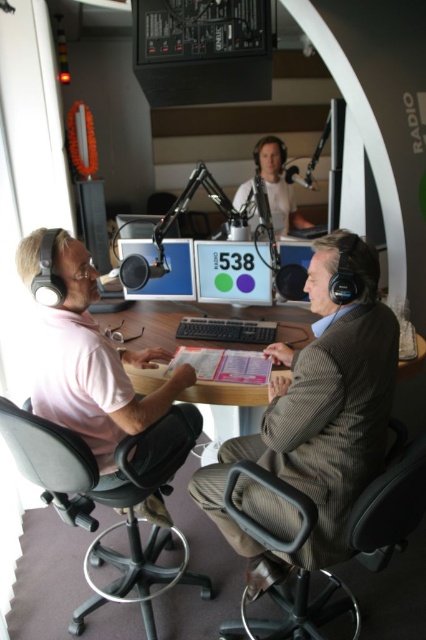
You are setting up a new microphone stand in the radio studio. The stand needs to be placed between the matte plastic computer screen at center and the matte black monitor at upper center. Which object should the microphone stand be closer to in order to avoid blocking the view of the monitor?

The microphone stand should be placed closer to the matte plastic computer screen at center since it is positioned under the matte black monitor at upper center, so placing it near the lower screen would avoid blocking the monitor above.

You are a technician in the radio studio and need to adjust the matte plastic computer screen at center. If your arm can reach up to 7 feet, will you be able to reach the screen without moving your position?

The matte plastic computer screen at center is 7.01 feet away from the camera, so it is just slightly out of reach since your arm can only extend up to 7 feet. You might need to move closer or use a tool to adjust it.

You are a technician in the radio studio. You need to adjust the matte plastic computer screen at center. Where is it located in terms of coordinates?

The matte plastic computer screen at center is located at coordinates point [230,273].